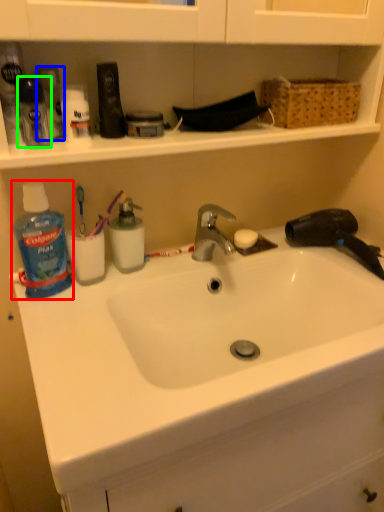
Question: Which object is the closest to the cleaning product (highlighted by a red box)? Choose among these: toiletry (highlighted by a blue box) or toiletry (highlighted by a green box).

Choices:
 (A) toiletry
 (B) toiletry

Answer: (A)